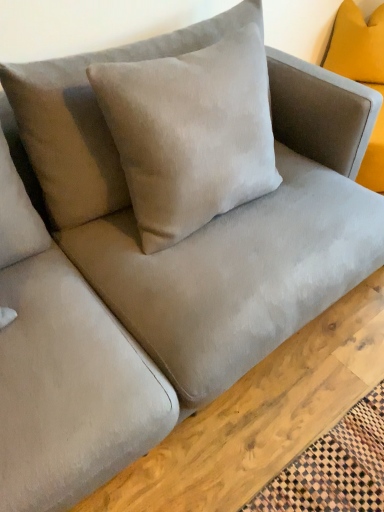
Question: From the image's perspective, is mustard velvet pillow at upper right, placed as the 2th pillow when sorted from front to back, under suede-like beige pillow at center, positioned as the 1th pillow in bottom-to-top order?

Choices:
 (A) yes
 (B) no

Answer: (B)

Question: Does mustard velvet pillow at upper right, which ranks as the first pillow in right-to-left order, have a larger size compared to suede-like beige pillow at center, placed as the first pillow when sorted from left to right?

Choices:
 (A) no
 (B) yes

Answer: (A)

Question: From the image's perspective, is mustard velvet pillow at upper right, which is the 1th pillow from back to front, located above suede-like beige pillow at center, placed as the 2th pillow when sorted from right to left?

Choices:
 (A) yes
 (B) no

Answer: (A)

Question: Considering the relative positions of mustard velvet pillow at upper right, which is the 1th pillow from back to front, and suede-like beige pillow at center, positioned as the 1th pillow in front-to-back order, in the image provided, is mustard velvet pillow at upper right, which is the 1th pillow from back to front, to the right of suede-like beige pillow at center, positioned as the 1th pillow in front-to-back order, from the viewer's perspective?

Choices:
 (A) yes
 (B) no

Answer: (A)

Question: Can you confirm if mustard velvet pillow at upper right, placed as the 2th pillow when sorted from front to back, is positioned to the left of suede-like beige pillow at center, which is the second pillow from back to front?

Choices:
 (A) yes
 (B) no

Answer: (B)

Question: Considering the positions of mustard velvet pillow at upper right, which is the 1th pillow from back to front, and suede-like beige pillow at center, positioned as the 2th pillow in top-to-bottom order, in the image, is mustard velvet pillow at upper right, which is the 1th pillow from back to front, wider or thinner than suede-like beige pillow at center, positioned as the 2th pillow in top-to-bottom order,?

Choices:
 (A) wide
 (B) thin

Answer: (B)

Question: Is mustard velvet pillow at upper right, placed as the 2th pillow when sorted from front to back, spatially inside suede-like beige pillow at center, positioned as the 2th pillow in top-to-bottom order, or outside of it?

Choices:
 (A) inside
 (B) outside

Answer: (B)

Question: In the image, is mustard velvet pillow at upper right, which ranks as the first pillow in right-to-left order, positioned in front of or behind suede-like beige pillow at center, placed as the first pillow when sorted from left to right?

Choices:
 (A) front
 (B) behind

Answer: (B)

Question: Considering the positions of mustard velvet pillow at upper right, which is the 1th pillow from back to front, and suede-like beige pillow at center, positioned as the 1th pillow in bottom-to-top order, in the image, is mustard velvet pillow at upper right, which is the 1th pillow from back to front, bigger or smaller than suede-like beige pillow at center, positioned as the 1th pillow in bottom-to-top order,?

Choices:
 (A) big
 (B) small

Answer: (B)

Question: From a real-world perspective, is matte gray couch at center positioned above or below suede-like beige pillow at center, which is the second pillow from back to front?

Choices:
 (A) above
 (B) below

Answer: (B)

Question: Considering the positions of matte gray couch at center and suede-like beige pillow at center, placed as the first pillow when sorted from left to right, in the image, is matte gray couch at center wider or thinner than suede-like beige pillow at center, placed as the first pillow when sorted from left to right,?

Choices:
 (A) wide
 (B) thin

Answer: (A)

Question: In the image, is matte gray couch at center on the left side or the right side of suede-like beige pillow at center, placed as the first pillow when sorted from left to right?

Choices:
 (A) right
 (B) left

Answer: (A)

Question: Is matte gray couch at center taller or shorter than suede-like beige pillow at center, positioned as the 1th pillow in front-to-back order?

Choices:
 (A) tall
 (B) short

Answer: (B)

Question: From a real-world perspective, is suede-like beige pillow at center, placed as the first pillow when sorted from left to right, above or below mustard velvet pillow at upper right, which is the 1th pillow from back to front?

Choices:
 (A) above
 (B) below

Answer: (A)

Question: Considering the positions of point (105, 204) and point (360, 61), is point (105, 204) closer or farther from the camera than point (360, 61)?

Choices:
 (A) farther
 (B) closer

Answer: (B)